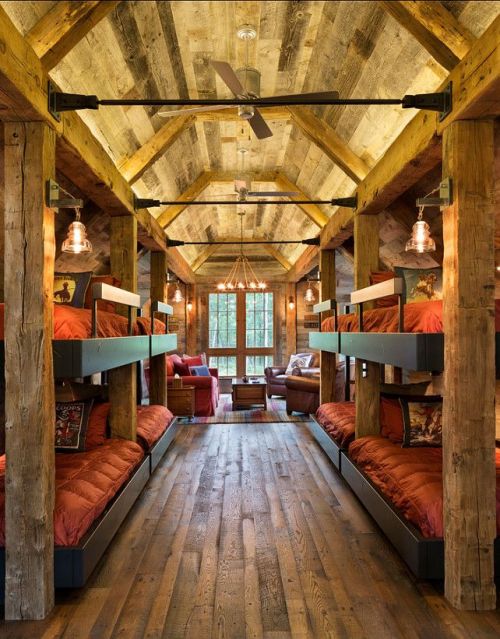
What are the coordinates of `rug` in the screenshot? It's located at (221, 406), (276, 412).